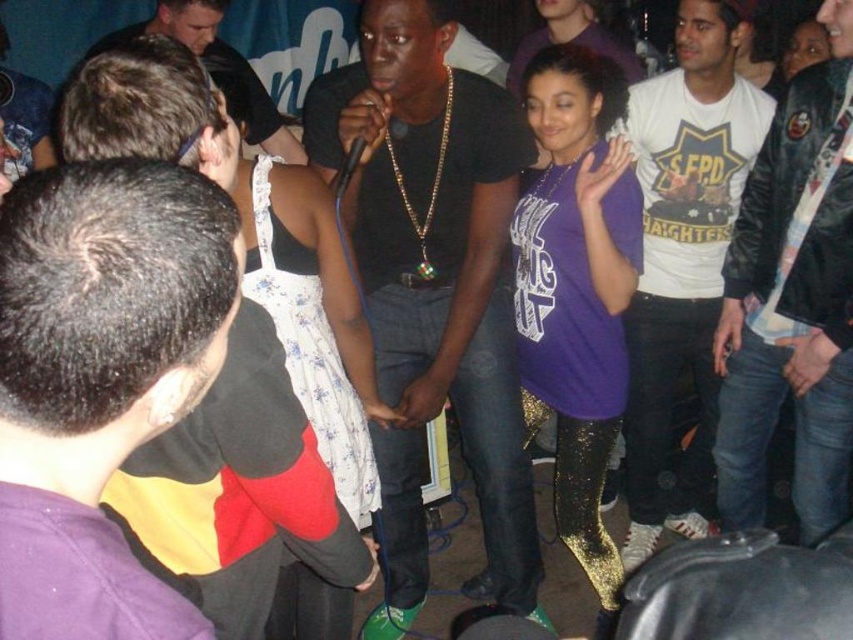
You are standing at the entrance of the venue and want to locate the performer wearing the black matte shirt at center. According to the coordinates provided, where should you look to find them?

The performer wearing the black matte shirt at center is located at the coordinates point (434, 280), so you should look towards the center of the image slightly to the right and lower middle area.

In the scene shown: You are at a party and want to find the person wearing the matte black shirt at center. According to the coordinates provided, where exactly should you look in the image?

The matte black shirt at center is located at point 0.678 on the x axis and 0.313 on the y axis.